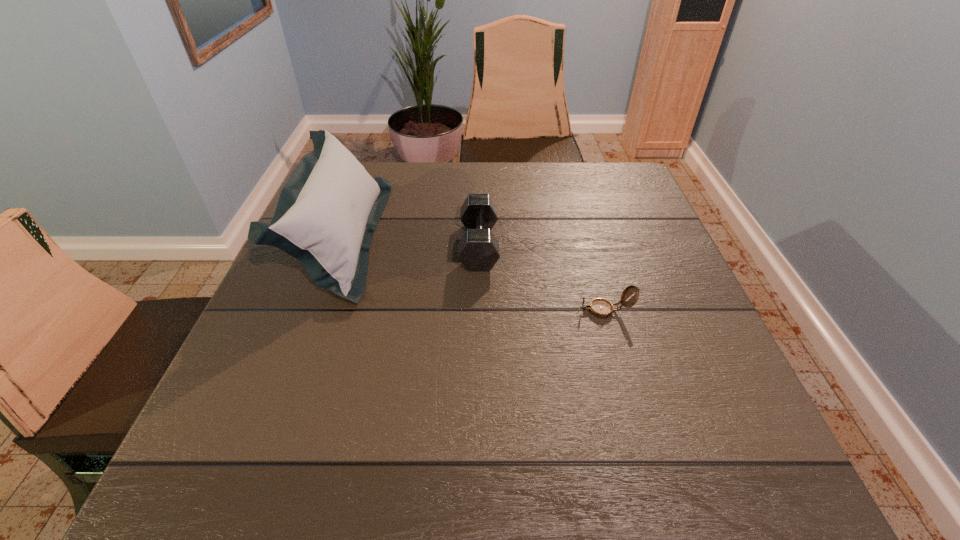
Where is `empty space between the second tallest object and the leftmost object`? The width and height of the screenshot is (960, 540). empty space between the second tallest object and the leftmost object is located at coordinates (410, 241).

You are a GUI agent. You are given a task and a screenshot of the screen. Output one action in this format:
    pyautogui.click(x=<x>, y=<y>)
    Task: Click on the free space between the cushion and the compass
    The height and width of the screenshot is (540, 960).
    Given the screenshot: What is the action you would take?
    pyautogui.click(x=473, y=274)

Find the location of `unoccupied position between the shortest object and the tallest object`. unoccupied position between the shortest object and the tallest object is located at coordinates (473, 274).

Identify the location of free space between the cushion and the shortest object. (473, 274).

Image resolution: width=960 pixels, height=540 pixels. I want to click on empty space that is in between the second object from left to right and the leftmost object, so click(x=410, y=241).

Find the location of `vacant space that is in between the tallest object and the shortest object`. vacant space that is in between the tallest object and the shortest object is located at coordinates (473, 274).

This screenshot has width=960, height=540. What are the coordinates of `free area in between the second tallest object and the shortest object` in the screenshot? It's located at (542, 278).

Locate an element on the screen. free space between the rightmost object and the tallest object is located at coordinates (473, 274).

Where is `free spot between the dumbbell and the cushion`? free spot between the dumbbell and the cushion is located at coordinates (410, 241).

Identify which object is the second nearest to the dumbbell. Please provide its 2D coordinates. Your answer should be formatted as a tuple, i.e. [(x, y)], where the tuple contains the x and y coordinates of a point satisfying the conditions above.

[(327, 212)]